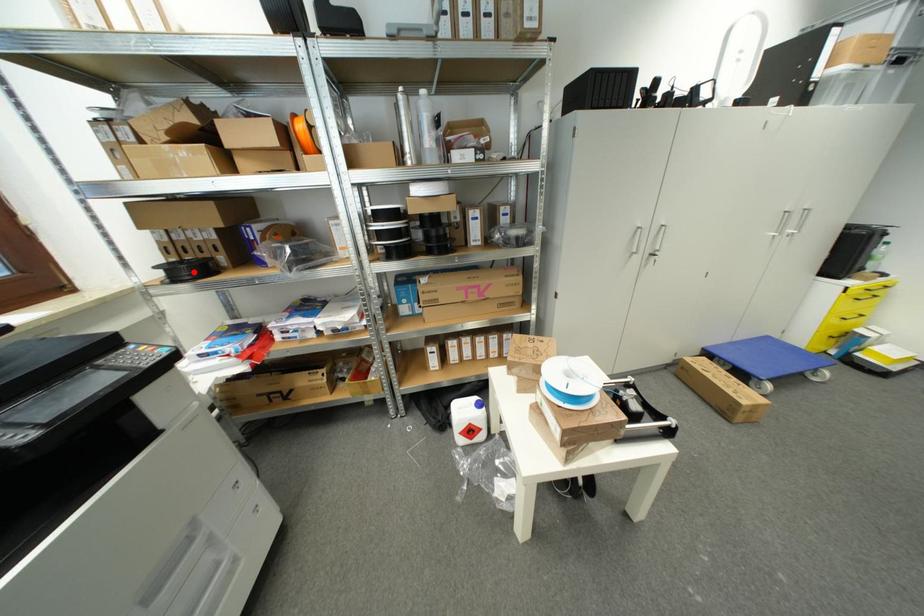
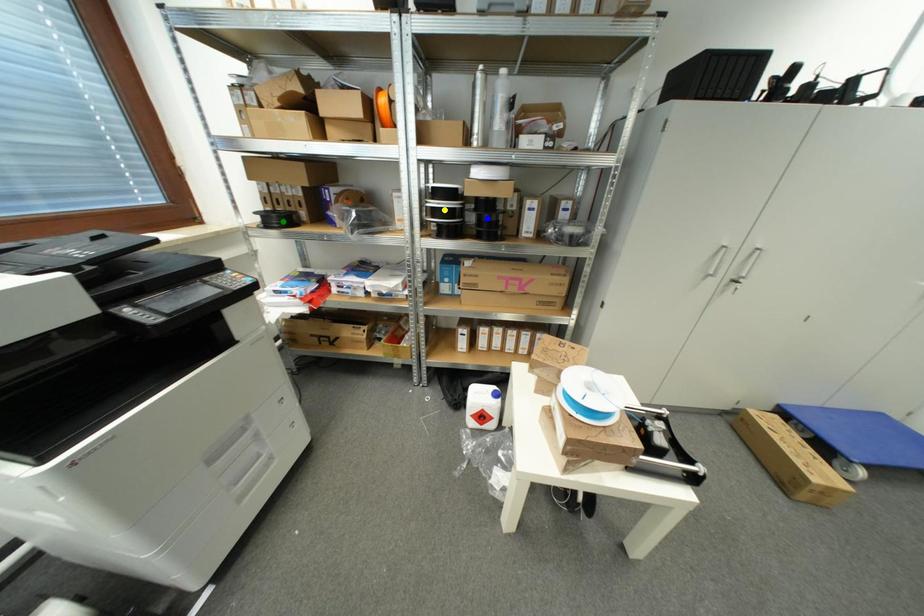
Question: I am providing you with two images of the same scene from different viewpoints. A red point is marked on the first image. You are given multiple points on the second image. Which point in image 2 is actually the same real-world point as the red point in image 1?

Choices:
 (A) blue point
 (B) green point
 (C) yellow point

Answer: (B)